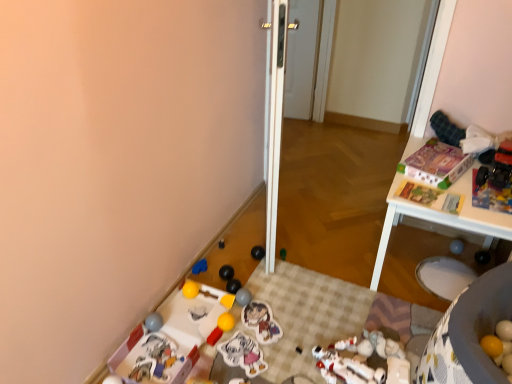
The image size is (512, 384). In order to click on vacant location behind matte gray ball at center, marked as the tenth toy in a left-to-right arrangement in this screenshot , I will do `click(251, 281)`.